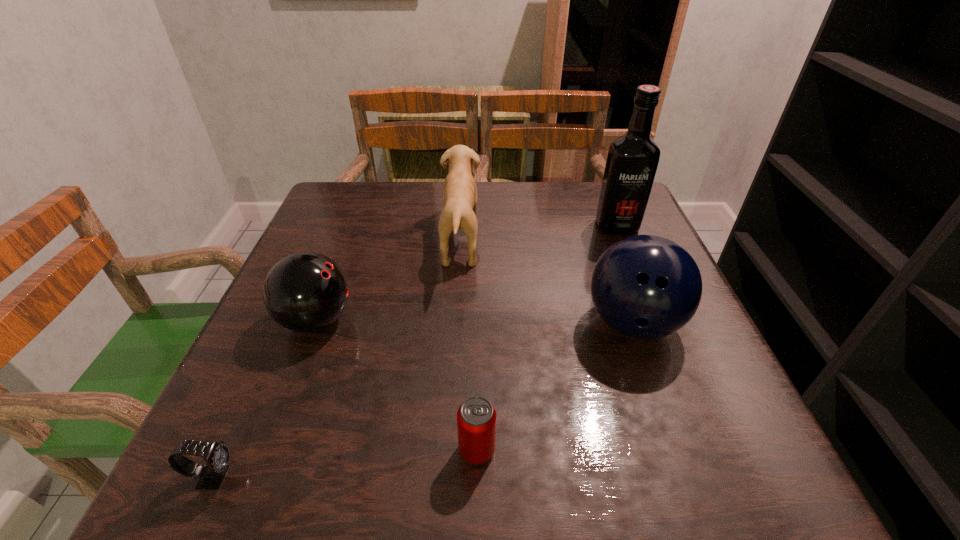
This screenshot has width=960, height=540. Find the location of `object that is the second closest to the can`. object that is the second closest to the can is located at coordinates (304, 292).

Locate which object ranks in proximity to the shortest object. Please provide its 2D coordinates. Your answer should be formatted as a tuple, i.e. [(x, y)], where the tuple contains the x and y coordinates of a point satisfying the conditions above.

[(304, 292)]

Identify the location of vacant space that satisfies the following two spatial constraints: 1. on the front-facing side of the liquor; 2. on the face of the shortest object. The width and height of the screenshot is (960, 540). (720, 476).

In order to click on vacant area in the image that satisfies the following two spatial constraints: 1. on the front-facing side of the tallest object; 2. on the face of the watch in this screenshot , I will do `click(720, 476)`.

The image size is (960, 540). In order to click on vacant space that satisfies the following two spatial constraints: 1. on the back side of the fifth tallest object; 2. on the left side of the puppy in this screenshot , I will do `click(478, 241)`.

You are a GUI agent. You are given a task and a screenshot of the screen. Output one action in this format:
    pyautogui.click(x=<x>, y=<y>)
    Task: Click on the free space that satisfies the following two spatial constraints: 1. on the front-facing side of the tallest object; 2. on the face of the shortest object
    
    Given the screenshot: What is the action you would take?
    pyautogui.click(x=720, y=476)

Find the location of a particular element. The height and width of the screenshot is (540, 960). free location that satisfies the following two spatial constraints: 1. on the left side of the puppy; 2. on the left side of the fifth tallest object is located at coordinates (448, 450).

Where is `free space in the image that satisfies the following two spatial constraints: 1. on the surface of the right bowling ball near the finger holes; 2. on the face of the watch`? This screenshot has height=540, width=960. free space in the image that satisfies the following two spatial constraints: 1. on the surface of the right bowling ball near the finger holes; 2. on the face of the watch is located at coordinates pos(687,476).

This screenshot has width=960, height=540. Identify the location of blank area in the image that satisfies the following two spatial constraints: 1. on the front side of the can; 2. on the face of the watch. (477, 476).

Image resolution: width=960 pixels, height=540 pixels. What are the coordinates of `free spot that satisfies the following two spatial constraints: 1. on the front-facing side of the tallest object; 2. on the surface of the shorter bowling ball near the finger holes` in the screenshot? It's located at (656, 320).